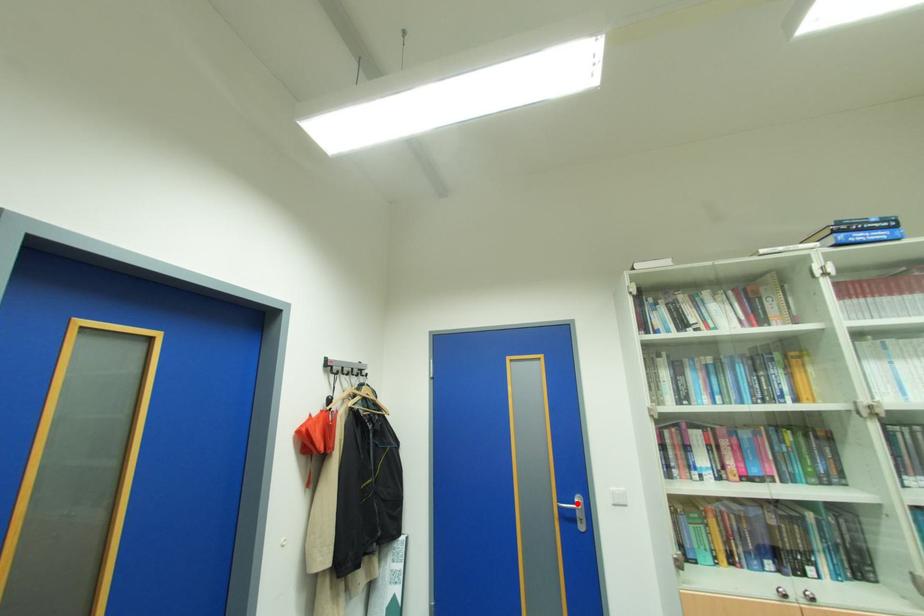
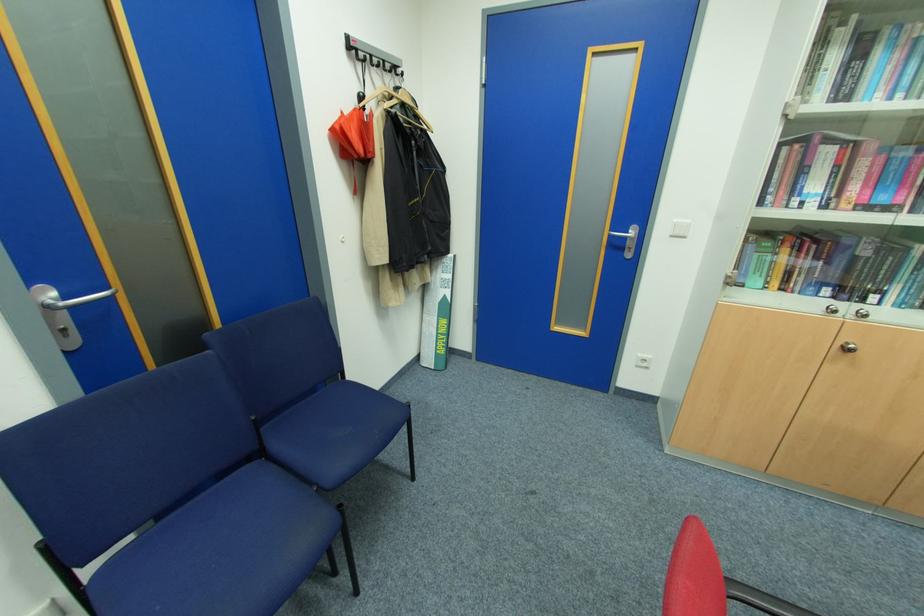
The point at the highlighted location is marked in the first image. Where is the corresponding point in the second image?

(630, 233)